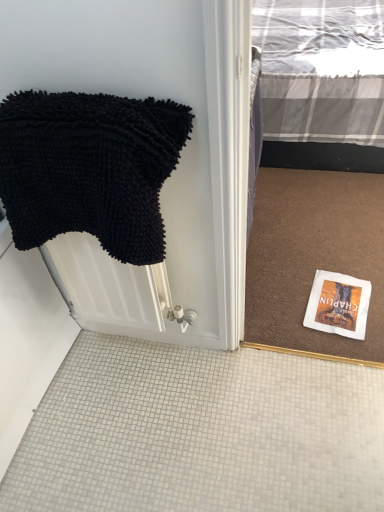
Question: Does black chenille towel at left have a larger size compared to white paper book cover at lower right?

Choices:
 (A) no
 (B) yes

Answer: (B)

Question: Is black chenille towel at left positioned behind white paper book cover at lower right?

Choices:
 (A) no
 (B) yes

Answer: (A)

Question: Considering the relative sizes of black chenille towel at left and white paper book cover at lower right in the image provided, is black chenille towel at left thinner than white paper book cover at lower right?

Choices:
 (A) yes
 (B) no

Answer: (A)

Question: Is white paper book cover at lower right at the back of black chenille towel at left?

Choices:
 (A) no
 (B) yes

Answer: (A)

Question: Can you confirm if black chenille towel at left is smaller than white paper book cover at lower right?

Choices:
 (A) yes
 (B) no

Answer: (B)

Question: Does black chenille towel at left appear on the right side of white paper book cover at lower right?

Choices:
 (A) no
 (B) yes

Answer: (A)

Question: Is the position of white paper book cover at lower right more distant than that of black chenille towel at left?

Choices:
 (A) no
 (B) yes

Answer: (B)

Question: Can you confirm if white paper book cover at lower right is wider than black chenille towel at left?

Choices:
 (A) yes
 (B) no

Answer: (A)

Question: Does white paper book cover at lower right have a larger size compared to black chenille towel at left?

Choices:
 (A) no
 (B) yes

Answer: (A)

Question: Can you confirm if white paper book cover at lower right is positioned to the left of black chenille towel at left?

Choices:
 (A) yes
 (B) no

Answer: (B)

Question: Considering the relative positions of white paper book cover at lower right and black chenille towel at left in the image provided, is white paper book cover at lower right to the right of black chenille towel at left from the viewer's perspective?

Choices:
 (A) yes
 (B) no

Answer: (A)

Question: Is white paper book cover at lower right far from black chenille towel at left?

Choices:
 (A) no
 (B) yes

Answer: (A)

Question: Considering the positions of point (339, 309) and point (127, 120), is point (339, 309) closer or farther from the camera than point (127, 120)?

Choices:
 (A) farther
 (B) closer

Answer: (A)